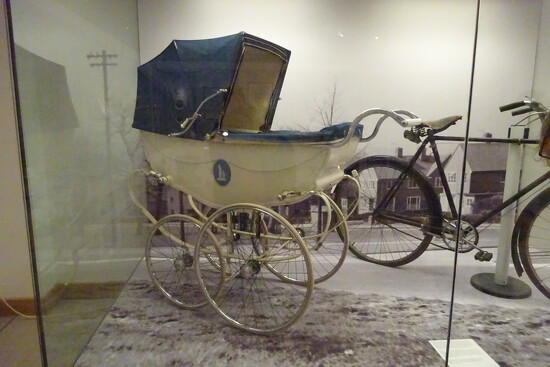
Locate an element on the screen. seat' is located at coordinates (440, 120).